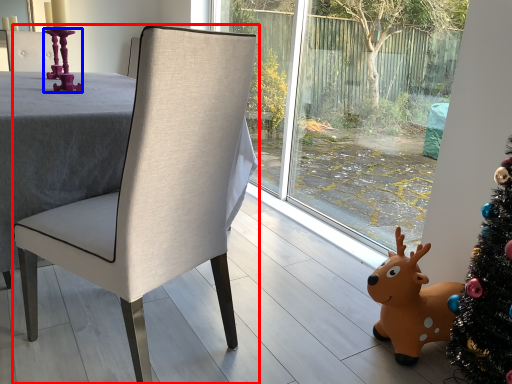
Question: Which object is further to the camera taking this photo, chair (highlighted by a red box) or candle holder (highlighted by a blue box)?

Choices:
 (A) chair
 (B) candle holder

Answer: (B)